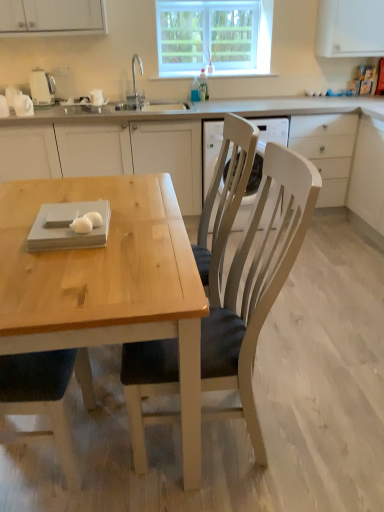
At what (x,y) coordinates should I click in order to perform the action: click on free spot to the right of wooden chair at center. Please return your answer as a coordinate pair (x, y). The width and height of the screenshot is (384, 512). Looking at the image, I should click on (323, 414).